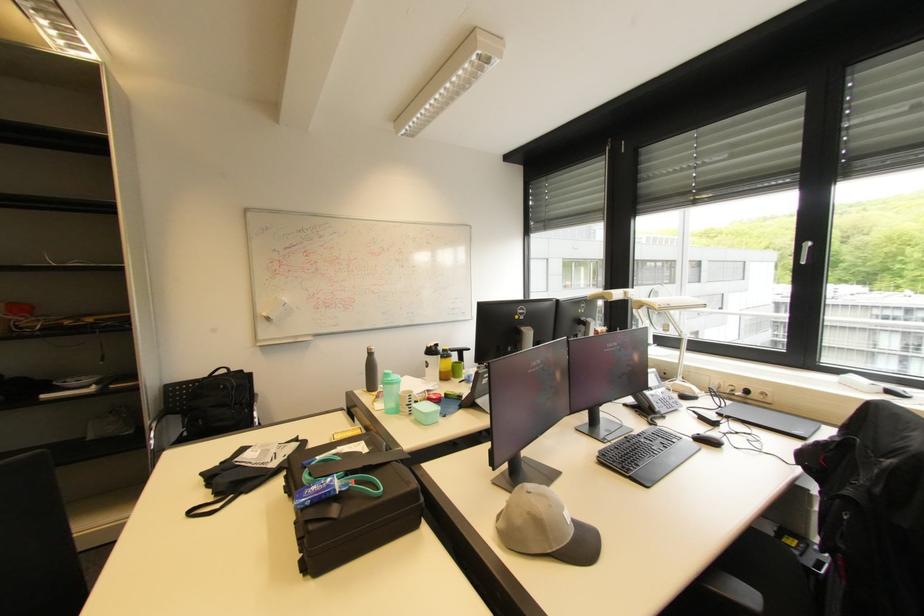
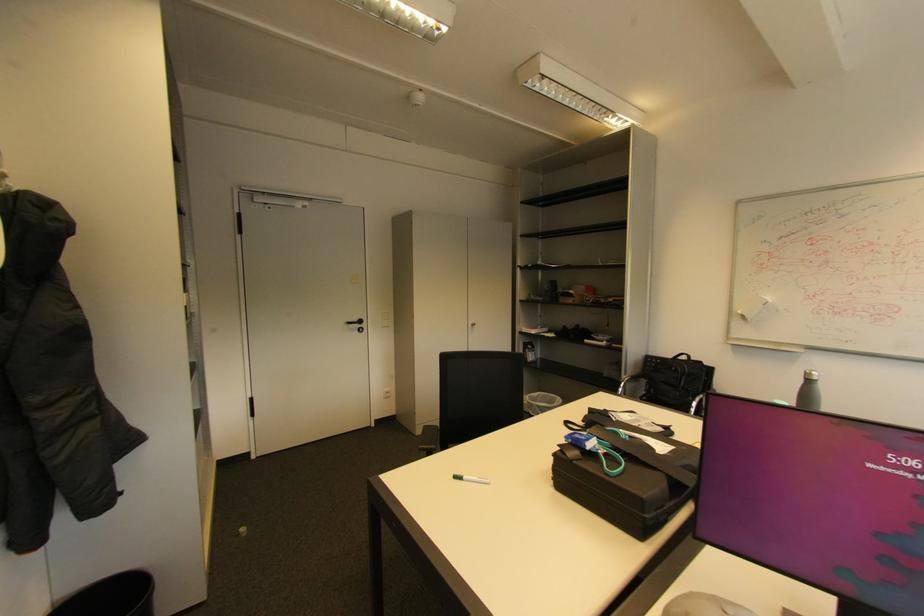
The point at (372, 350) is marked in the first image. Where is the corresponding point in the second image?

(811, 373)